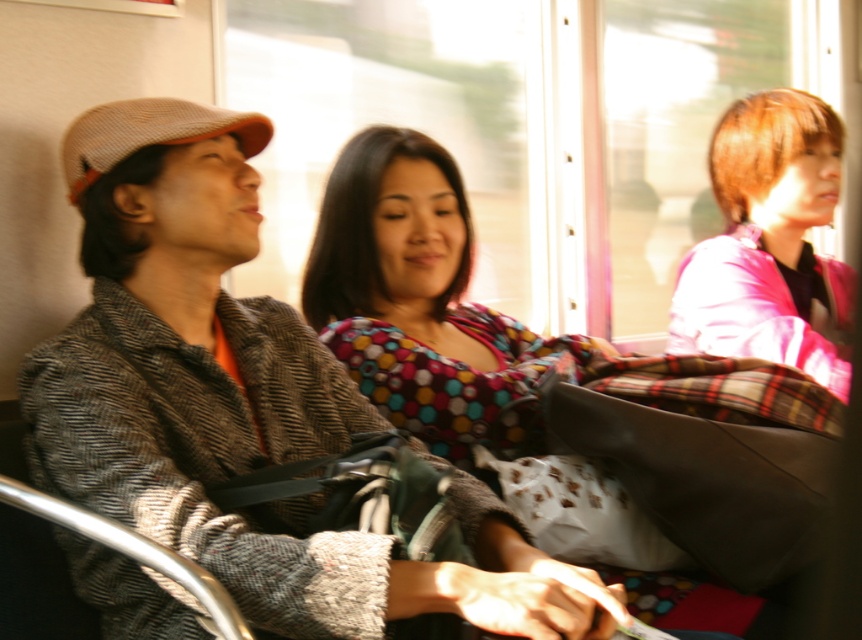
Is polka dot fabric dress at center to the left of pink fabric at upper right from the viewer's perspective?

Indeed, polka dot fabric dress at center is positioned on the left side of pink fabric at upper right.

Between polka dot fabric dress at center and pink fabric at upper right, which one appears on the right side from the viewer's perspective?

Positioned to the right is pink fabric at upper right.

Image resolution: width=862 pixels, height=640 pixels. I want to click on polka dot fabric dress at center, so click(x=481, y=320).

Locate an element on the screen. The width and height of the screenshot is (862, 640). polka dot fabric dress at center is located at coordinates (481, 320).